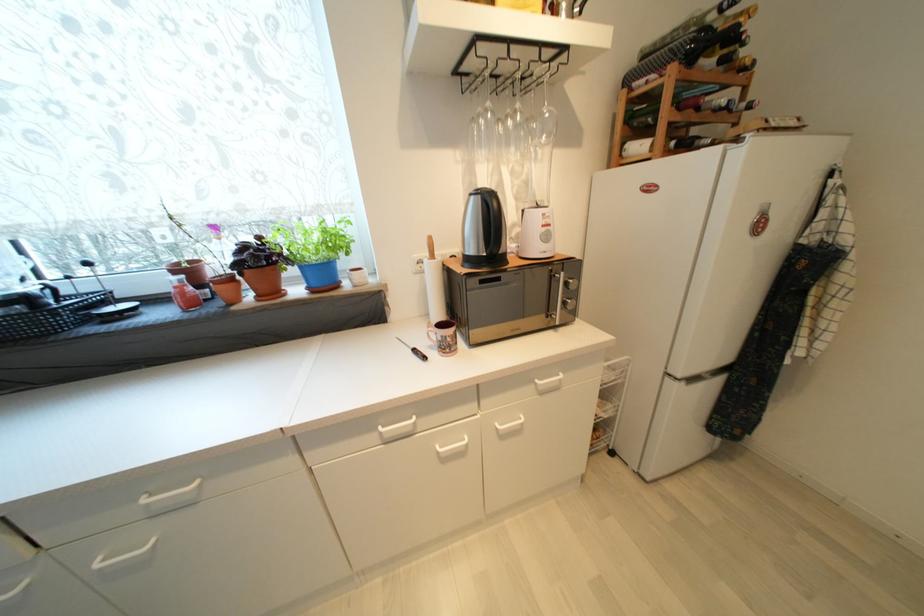
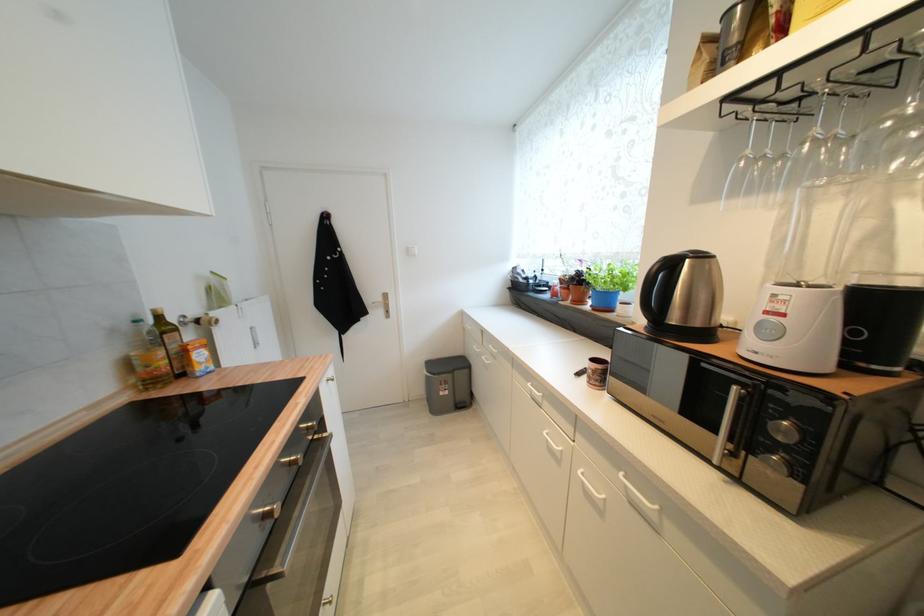
First-person continuous shooting, in which direction is the camera rotating?

The rotation direction of the camera is left-down.